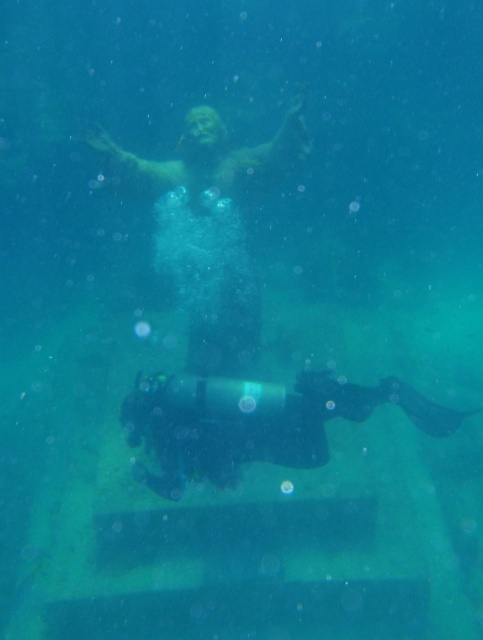
Is point (235, 300) less distant than point (411, 413)?

No, it is behind (411, 413).

Between matte bronze statue at center and black matte scuba diver at lower center, which one appears on the right side from the viewer's perspective?

Positioned to the right is black matte scuba diver at lower center.

From the picture: Measure the distance between point (210, 364) and camera.

They are 14.42 feet apart.

You are a GUI agent. You are given a task and a screenshot of the screen. Output one action in this format:
    pyautogui.click(x=<x>, y=<y>)
    Task: Click on the matte bronze statue at center
    
    Given the screenshot: What is the action you would take?
    (x=211, y=230)